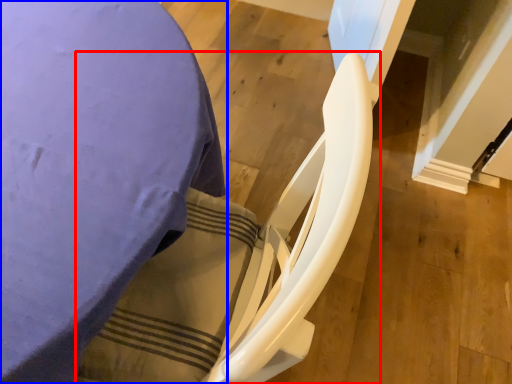
Question: Which object is further to the camera taking this photo, rocking chair (highlighted by a red box) or furniture (highlighted by a blue box)?

Choices:
 (A) rocking chair
 (B) furniture

Answer: (B)